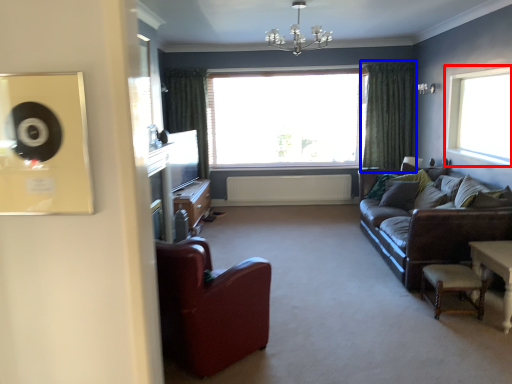
Question: Which object appears closest to the camera in this image, window (highlighted by a red box) or curtain (highlighted by a blue box)?

Choices:
 (A) window
 (B) curtain

Answer: (A)